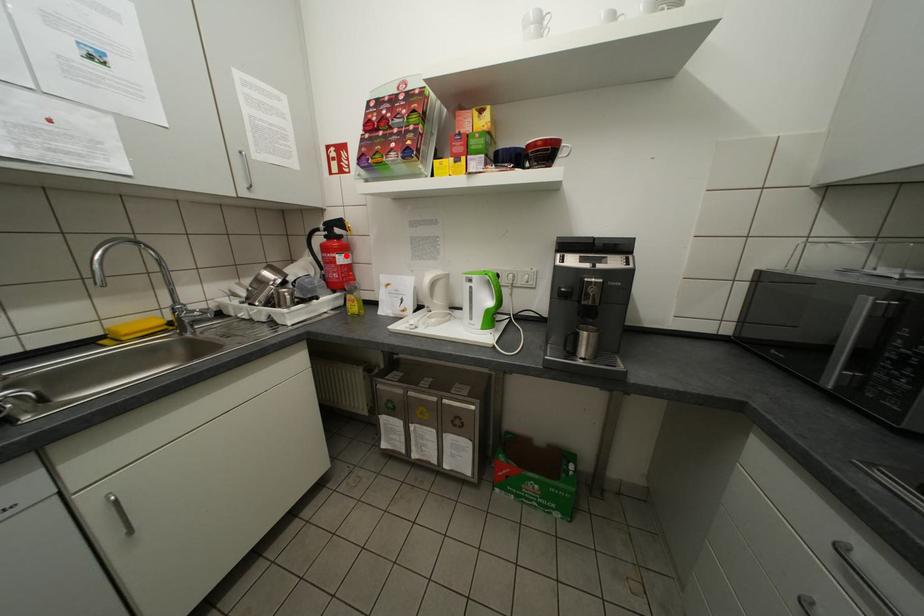
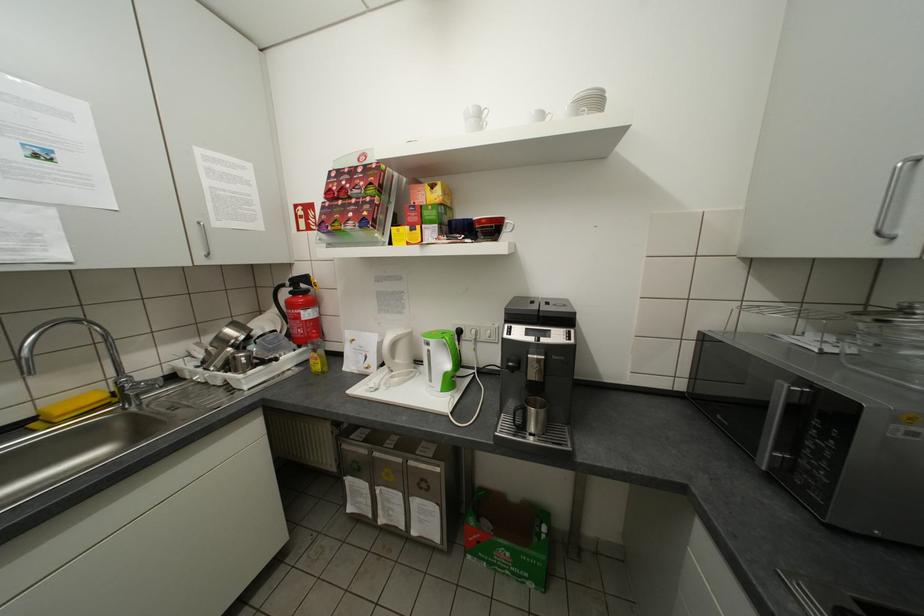
Locate, in the second image, the point that corresponds to the highlighted location in the first image.

(310, 312)